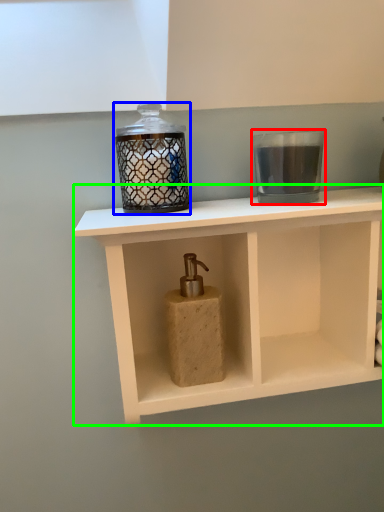
Question: Considering the real-world distances, which object is farthest from candle holder (highlighted by a red box)? candle holder (highlighted by a blue box) or shelf (highlighted by a green box)?

Choices:
 (A) candle holder
 (B) shelf

Answer: (B)